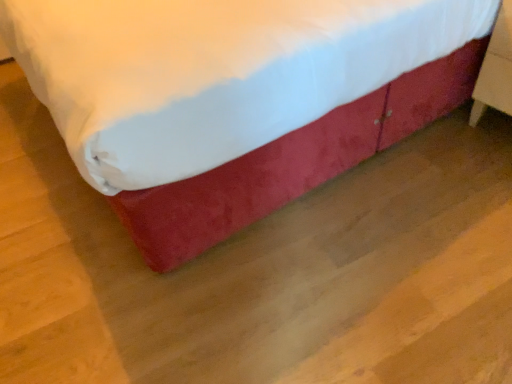
Question: Is point (498, 99) positioned closer to the camera than point (321, 102)?

Choices:
 (A) closer
 (B) farther

Answer: (B)

Question: Is wooden nightstand at right inside or outside of velvet red bed at center?

Choices:
 (A) inside
 (B) outside

Answer: (A)

Question: From a real-world perspective, is wooden nightstand at right positioned above or below velvet red bed at center?

Choices:
 (A) above
 (B) below

Answer: (B)

Question: Looking at their shapes, would you say velvet red bed at center is wider or thinner than wooden nightstand at right?

Choices:
 (A) wide
 (B) thin

Answer: (A)

Question: From the image's perspective, is velvet red bed at center positioned above or below wooden nightstand at right?

Choices:
 (A) below
 (B) above

Answer: (B)

Question: Looking at the image, does velvet red bed at center seem bigger or smaller compared to wooden nightstand at right?

Choices:
 (A) small
 (B) big

Answer: (B)

Question: Does point (207, 51) appear closer or farther from the camera than point (498, 74)?

Choices:
 (A) farther
 (B) closer

Answer: (B)